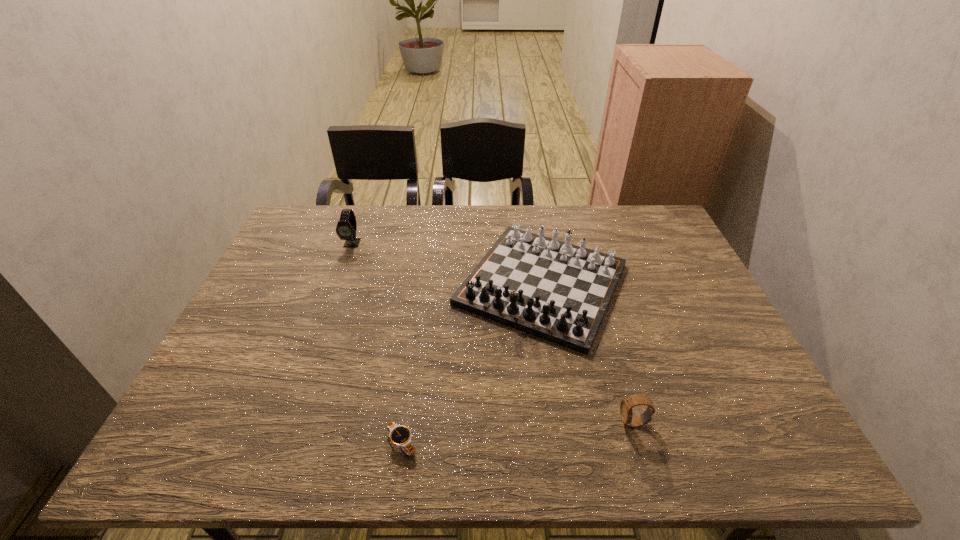
In the image, there is a desktop. Identify the location of vacant space at the near right corner. This screenshot has width=960, height=540. [718, 426].

Where is `free space between the leftmost watch and the third object from right to left`? free space between the leftmost watch and the third object from right to left is located at coordinates (377, 343).

Where is `vacant area that lies between the leftmost watch and the chessboard`? vacant area that lies between the leftmost watch and the chessboard is located at coordinates (447, 264).

You are a GUI agent. You are given a task and a screenshot of the screen. Output one action in this format:
    pyautogui.click(x=<x>, y=<y>)
    Task: Click on the free space between the chessboard and the tallest object
    The height and width of the screenshot is (540, 960).
    Given the screenshot: What is the action you would take?
    pyautogui.click(x=447, y=264)

Where is `vacant area that lies between the second tallest watch and the second object from left to right`? This screenshot has width=960, height=540. vacant area that lies between the second tallest watch and the second object from left to right is located at coordinates (517, 433).

You are a GUI agent. You are given a task and a screenshot of the screen. Output one action in this format:
    pyautogui.click(x=<x>, y=<y>)
    Task: Click on the free space between the farthest watch and the third object from right to left
    Image resolution: width=960 pixels, height=540 pixels.
    Given the screenshot: What is the action you would take?
    pyautogui.click(x=377, y=343)

Identify the location of vacant point located between the tallest object and the chessboard. click(447, 264).

Image resolution: width=960 pixels, height=540 pixels. In order to click on vacant area between the second watch from left to right and the second tallest watch in this screenshot , I will do `click(517, 433)`.

Locate an element on the screen. The height and width of the screenshot is (540, 960). vacant point located between the third object from right to left and the chessboard is located at coordinates (472, 363).

Where is `vacant region between the shortest object and the farthest watch`? This screenshot has width=960, height=540. vacant region between the shortest object and the farthest watch is located at coordinates (377, 343).